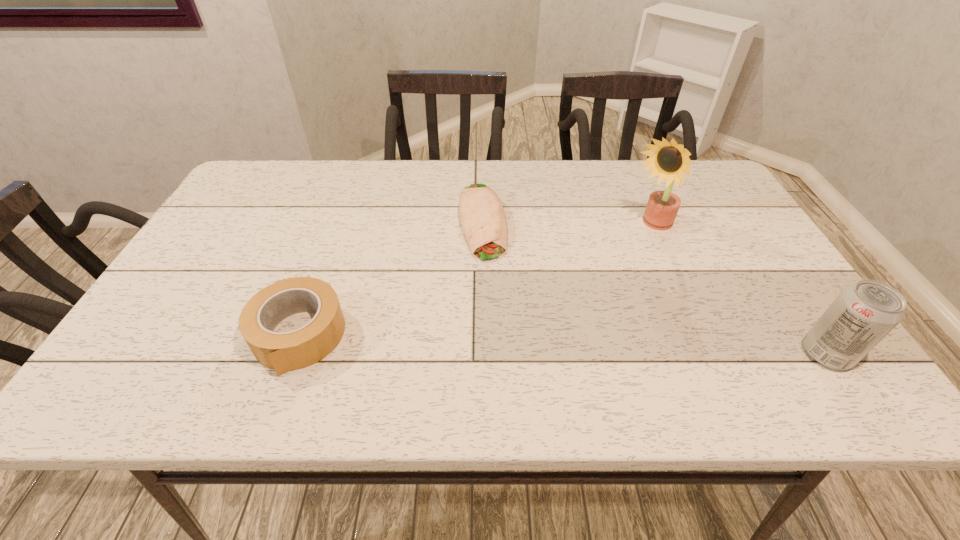
I want to click on blank space at the far edge of the desktop, so click(x=532, y=190).

You are a GUI agent. You are given a task and a screenshot of the screen. Output one action in this format:
    pyautogui.click(x=<x>, y=<y>)
    Task: Click on the free space at the near edge
    Image resolution: width=960 pixels, height=540 pixels.
    Given the screenshot: What is the action you would take?
    pyautogui.click(x=406, y=360)

At what (x,y) coordinates should I click in order to perform the action: click on free space at the left edge of the desktop. Please return your answer as a coordinate pair (x, y). Image resolution: width=960 pixels, height=540 pixels. Looking at the image, I should click on (241, 242).

At what (x,y) coordinates should I click in order to perform the action: click on vacant space at the right edge of the desktop. Please return your answer as a coordinate pair (x, y). The image size is (960, 540). Looking at the image, I should click on (706, 212).

Identify the location of vacant space that is in between the rightmost object and the third object from left to right. This screenshot has height=540, width=960. (738, 291).

Where is `vacant region between the third object from left to right and the burrito`? This screenshot has height=540, width=960. vacant region between the third object from left to right and the burrito is located at coordinates (566, 225).

At what (x,y) coordinates should I click in order to perform the action: click on unoccupied area between the tallest object and the soda can. Please return your answer as a coordinate pair (x, y). Looking at the image, I should click on (738, 291).

This screenshot has height=540, width=960. In order to click on free space between the duct tape and the third object from left to right in this screenshot , I will do `click(474, 282)`.

Where is `vacant space that's between the shortest object and the sunflower`? The height and width of the screenshot is (540, 960). vacant space that's between the shortest object and the sunflower is located at coordinates (566, 225).

At what (x,y) coordinates should I click in order to perform the action: click on unoccupied position between the sunflower and the soda can. Please return your answer as a coordinate pair (x, y). The image size is (960, 540). Looking at the image, I should click on (738, 291).